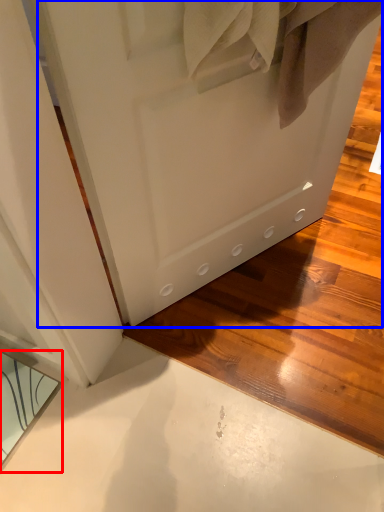
Question: Which point is closer to the camera, mirror (highlighted by a red box) or door (highlighted by a blue box)?

Choices:
 (A) mirror
 (B) door

Answer: (B)